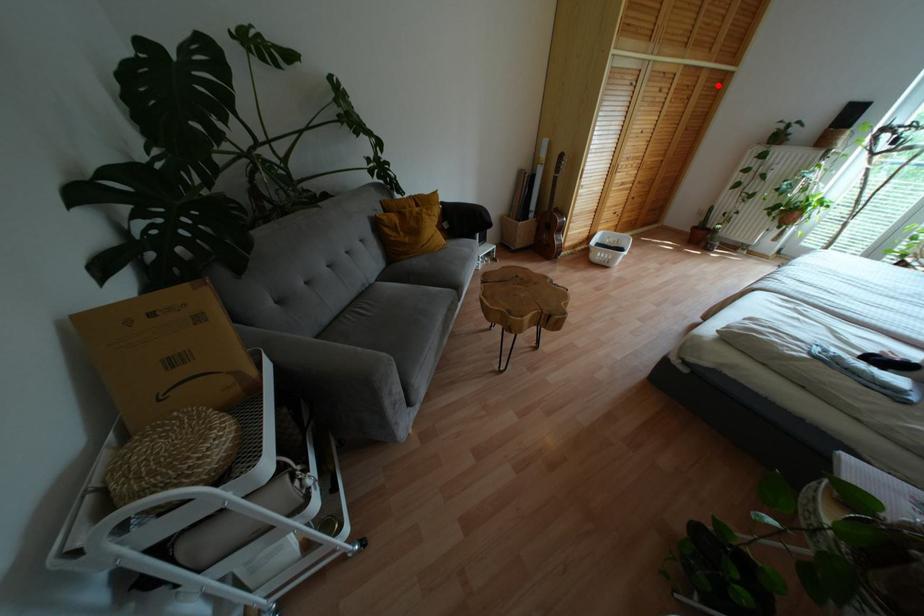
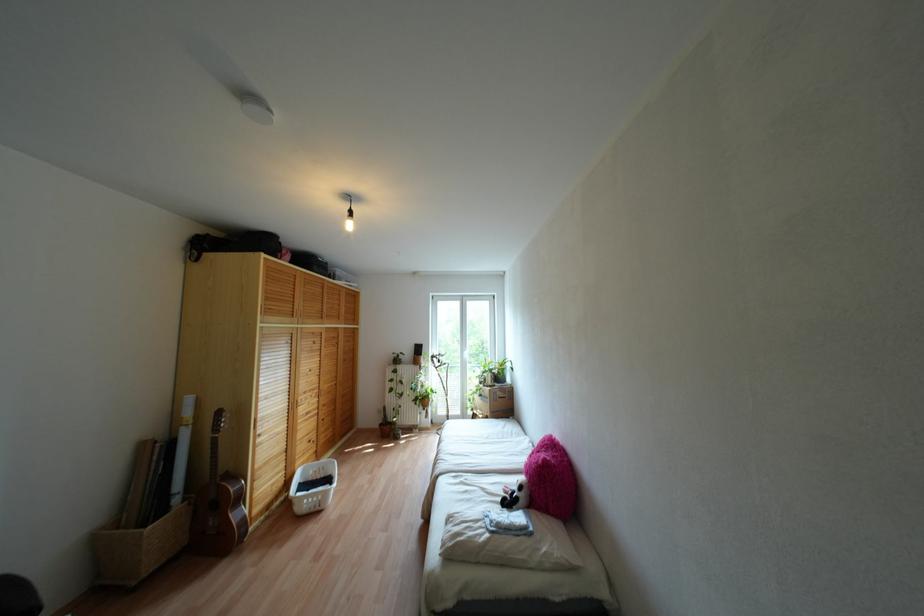
Locate, in the second image, the point that corresponds to the highlighted location in the first image.

(351, 334)